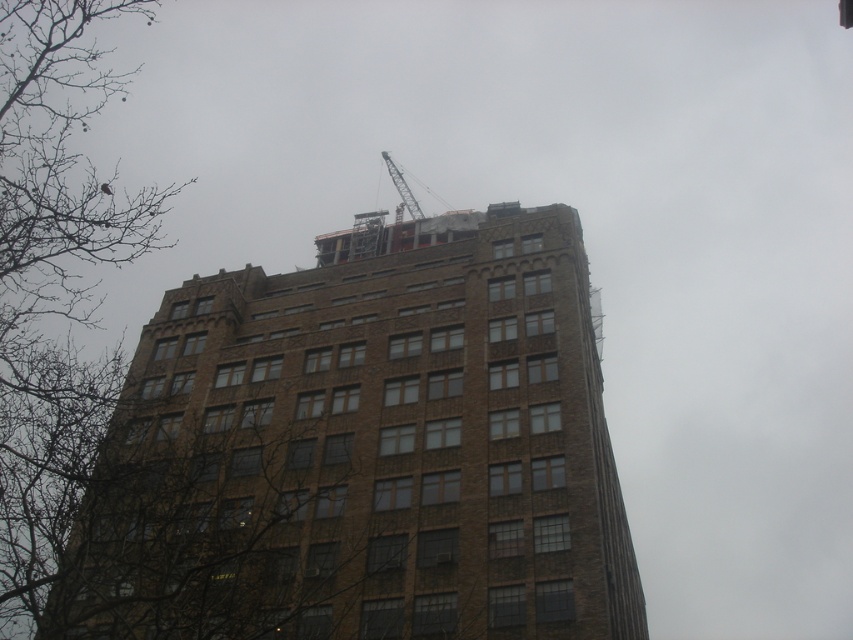
Question: Does brown brick building at center appear over metallic gray crane at top?

Choices:
 (A) no
 (B) yes

Answer: (A)

Question: Does brown brick building at center have a greater width compared to metallic gray crane at top?

Choices:
 (A) yes
 (B) no

Answer: (A)

Question: Is brown brick building at center above metallic gray crane at top?

Choices:
 (A) yes
 (B) no

Answer: (B)